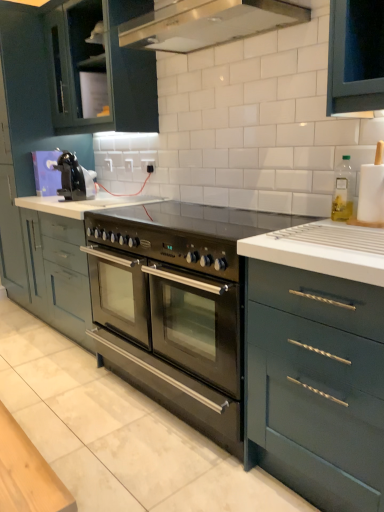
Question: Considering the relative sizes of stainless steel gas stove at center and black plastic outlet at center in the image provided, is stainless steel gas stove at center bigger than black plastic outlet at center?

Choices:
 (A) yes
 (B) no

Answer: (A)

Question: Is stainless steel gas stove at center facing away from black plastic outlet at center?

Choices:
 (A) yes
 (B) no

Answer: (B)

Question: Is stainless steel gas stove at center taller than black plastic outlet at center?

Choices:
 (A) yes
 (B) no

Answer: (A)

Question: Can you confirm if stainless steel gas stove at center is smaller than black plastic outlet at center?

Choices:
 (A) yes
 (B) no

Answer: (B)

Question: Is stainless steel gas stove at center placed right next to black plastic outlet at center?

Choices:
 (A) no
 (B) yes

Answer: (A)

Question: Based on their positions, is matte dark green cabinet at upper left, which is the 3th cabinetry from bottom to top, located to the left or right of satin white countertop at center?

Choices:
 (A) left
 (B) right

Answer: (B)

Question: From their relative heights in the image, would you say matte dark green cabinet at upper left, which is the 3th cabinetry from bottom to top, is taller or shorter than satin white countertop at center?

Choices:
 (A) short
 (B) tall

Answer: (B)

Question: Is matte dark green cabinet at upper left, which is the 3th cabinetry from bottom to top, bigger or smaller than satin white countertop at center?

Choices:
 (A) small
 (B) big

Answer: (B)

Question: From a real-world perspective, is matte dark green cabinet at upper left, which is the 3th cabinetry from bottom to top, positioned above or below satin white countertop at center?

Choices:
 (A) below
 (B) above

Answer: (B)

Question: From the image's perspective, is stainless steel gas stove at center located above or below white matte paper towel holder at right, which is the 2th appliance from back to front?

Choices:
 (A) below
 (B) above

Answer: (A)

Question: Based on their positions, is stainless steel gas stove at center located to the left or right of white matte paper towel holder at right, which is the 1th appliance in front-to-back order?

Choices:
 (A) right
 (B) left

Answer: (B)

Question: Is point (115, 221) closer or farther from the camera than point (382, 142)?

Choices:
 (A) farther
 (B) closer

Answer: (A)

Question: In terms of width, does stainless steel gas stove at center look wider or thinner when compared to white matte paper towel holder at right, which is the 2th appliance from back to front?

Choices:
 (A) thin
 (B) wide

Answer: (B)

Question: Would you say matte gray cabinets at center, the 2th cabinetry from the top, is to the left or to the right of stainless steel gas stove at center in the picture?

Choices:
 (A) left
 (B) right

Answer: (A)

Question: Is point (8, 245) closer or farther from the camera than point (145, 224)?

Choices:
 (A) closer
 (B) farther

Answer: (B)